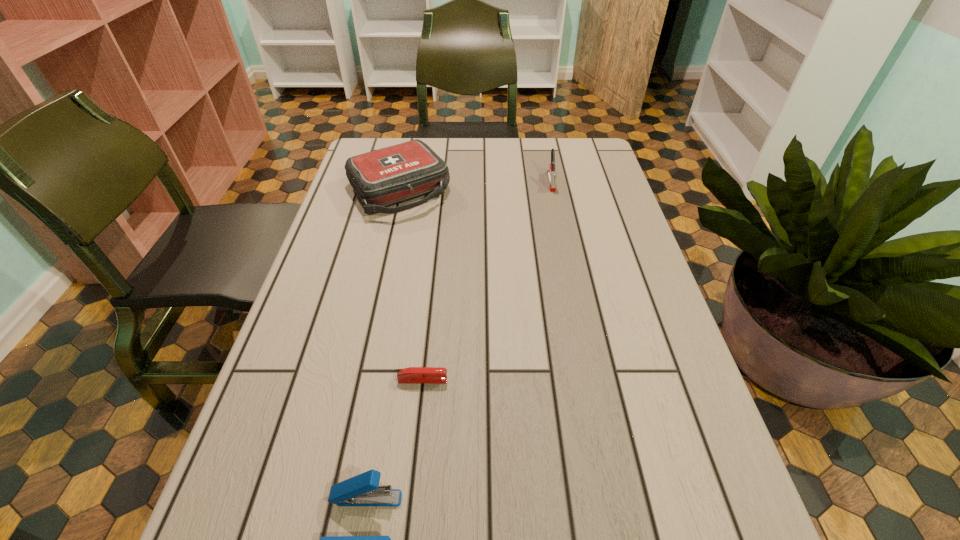
I want to click on free space between the first-aid kit and the rightmost stapler, so click(x=475, y=186).

You are a GUI agent. You are given a task and a screenshot of the screen. Output one action in this format:
    pyautogui.click(x=<x>, y=<y>)
    Task: Click on the unoccupied position between the first-aid kit and the farthest stapler
    This screenshot has width=960, height=540.
    Given the screenshot: What is the action you would take?
    pyautogui.click(x=475, y=186)

Select which object is the second closest to the third farthest object. Please provide its 2D coordinates. Your answer should be formatted as a tuple, i.e. [(x, y)], where the tuple contains the x and y coordinates of a point satisfying the conditions above.

[(387, 176)]

At what (x,y) coordinates should I click in order to perform the action: click on object that stands as the second closest to the first-aid kit. Please return your answer as a coordinate pair (x, y). This screenshot has width=960, height=540. Looking at the image, I should click on (412, 375).

Identify which stapler is the closest to the nearest object. Please provide its 2D coordinates. Your answer should be formatted as a tuple, i.e. [(x, y)], where the tuple contains the x and y coordinates of a point satisfying the conditions above.

[(412, 375)]

At what (x,y) coordinates should I click in order to perform the action: click on stapler that is the second closest one to the rightmost stapler. Please return your answer as a coordinate pair (x, y). This screenshot has height=540, width=960. Looking at the image, I should click on (362, 490).

Locate an element on the screen. Image resolution: width=960 pixels, height=540 pixels. vacant space that satisfies the following two spatial constraints: 1. on the handle side of the rightmost object; 2. on the front-facing side of the second farthest stapler is located at coordinates (591, 380).

Identify the location of free location that satisfies the following two spatial constraints: 1. on the handle side of the farthest stapler; 2. on the front-facing side of the shortest stapler. (591, 380).

Identify the location of free space that satisfies the following two spatial constraints: 1. on the handle side of the rightmost object; 2. on the front-facing side of the shortest stapler. Image resolution: width=960 pixels, height=540 pixels. (591, 380).

Where is `free space that satisfies the following two spatial constraints: 1. on the handle side of the rightmost object; 2. on the front-facing side of the second farthest stapler`? free space that satisfies the following two spatial constraints: 1. on the handle side of the rightmost object; 2. on the front-facing side of the second farthest stapler is located at coordinates (591, 380).